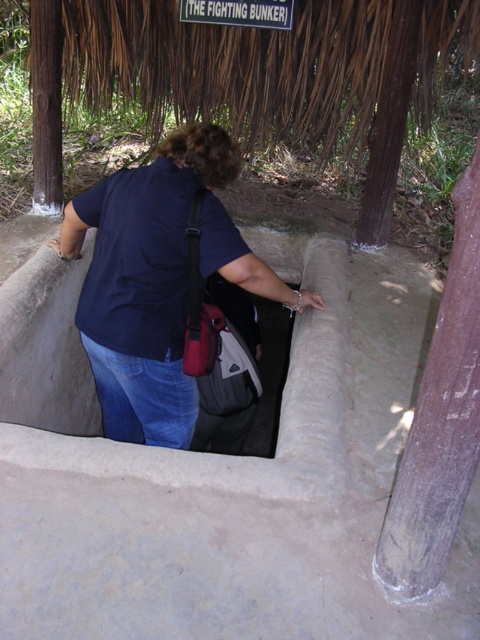
Question: Does gray concrete trench at center appear on the right side of dark blue shirt at center?

Choices:
 (A) no
 (B) yes

Answer: (B)

Question: Can you confirm if gray concrete trench at center is smaller than dark blue shirt at center?

Choices:
 (A) no
 (B) yes

Answer: (A)

Question: Which object appears farthest from the camera in this image?

Choices:
 (A) dark blue shirt at center
 (B) gray concrete trench at center

Answer: (A)

Question: Is the position of gray concrete trench at center less distant than that of dark blue shirt at center?

Choices:
 (A) no
 (B) yes

Answer: (B)

Question: Among these points, which one is farthest from the camera?

Choices:
 (A) (327, 509)
 (B) (210, 273)

Answer: (B)